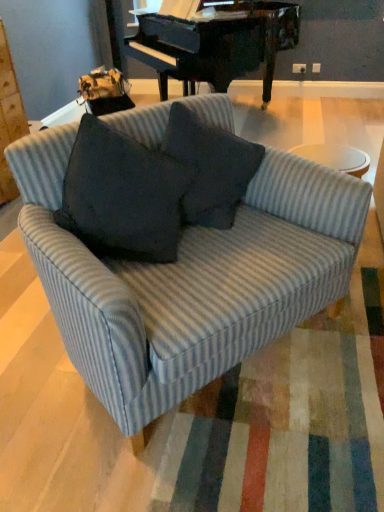
Question: From a real-world perspective, is striped fabric couch at center on gray corduroy throw pillow at center?

Choices:
 (A) no
 (B) yes

Answer: (A)

Question: Does striped fabric couch at center have a lesser height compared to gray corduroy throw pillow at center?

Choices:
 (A) yes
 (B) no

Answer: (B)

Question: Does striped fabric couch at center appear on the right side of gray corduroy throw pillow at center?

Choices:
 (A) yes
 (B) no

Answer: (B)

Question: From the image's perspective, would you say striped fabric couch at center is shown under gray corduroy throw pillow at center?

Choices:
 (A) yes
 (B) no

Answer: (A)

Question: Is striped fabric couch at center oriented away from gray corduroy throw pillow at center?

Choices:
 (A) no
 (B) yes

Answer: (B)

Question: Does striped fabric couch at center lie behind gray corduroy throw pillow at center?

Choices:
 (A) no
 (B) yes

Answer: (A)

Question: Can you confirm if gray corduroy throw pillow at center is positioned to the left of striped fabric couch at center?

Choices:
 (A) yes
 (B) no

Answer: (B)

Question: Considering the relative positions of gray corduroy throw pillow at center and striped fabric couch at center in the image provided, is gray corduroy throw pillow at center to the right of striped fabric couch at center from the viewer's perspective?

Choices:
 (A) no
 (B) yes

Answer: (B)

Question: Considering the relative sizes of gray corduroy throw pillow at center and striped fabric couch at center in the image provided, is gray corduroy throw pillow at center wider than striped fabric couch at center?

Choices:
 (A) no
 (B) yes

Answer: (A)

Question: Considering the relative sizes of gray corduroy throw pillow at center and striped fabric couch at center in the image provided, is gray corduroy throw pillow at center smaller than striped fabric couch at center?

Choices:
 (A) yes
 (B) no

Answer: (A)

Question: Is the surface of gray corduroy throw pillow at center in direct contact with striped fabric couch at center?

Choices:
 (A) yes
 (B) no

Answer: (B)

Question: Can you confirm if gray corduroy throw pillow at center is bigger than striped fabric couch at center?

Choices:
 (A) no
 (B) yes

Answer: (A)

Question: From the image's perspective, is striped fabric couch at center above or below gray corduroy throw pillow at center?

Choices:
 (A) above
 (B) below

Answer: (B)